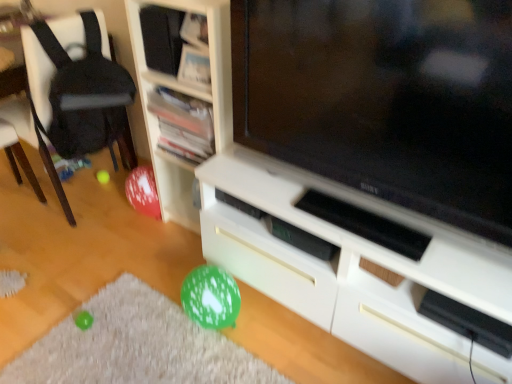
You are a GUI agent. You are given a task and a screenshot of the screen. Output one action in this format:
    pyautogui.click(x=<x>, y=<y>)
    Task: Click on the vacant space underneath matte black television at center (from a real-world perspective)
    The image size is (512, 384).
    Given the screenshot: What is the action you would take?
    pyautogui.click(x=343, y=213)